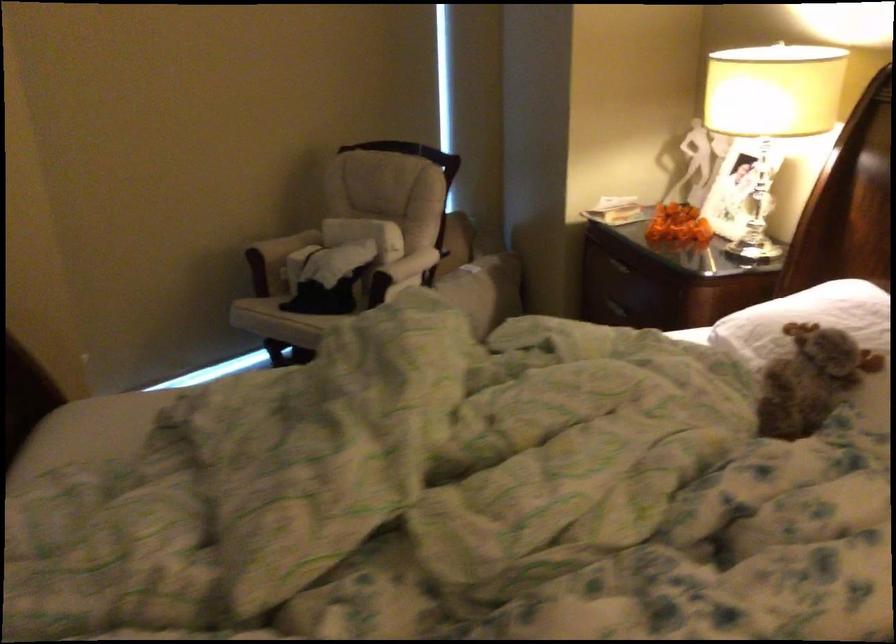
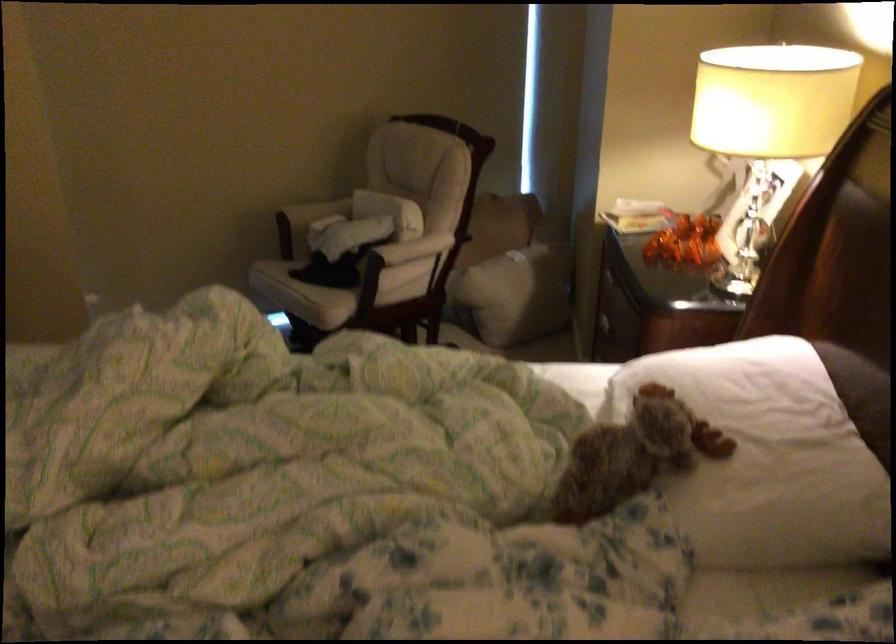
Where in the second image is the point corresponding to point 675,427 from the first image?

(373, 486)